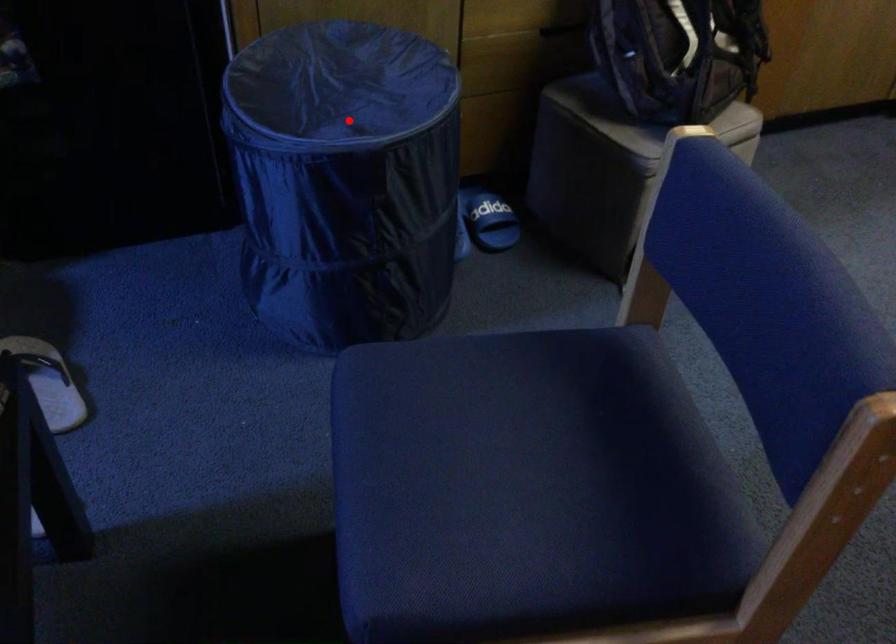
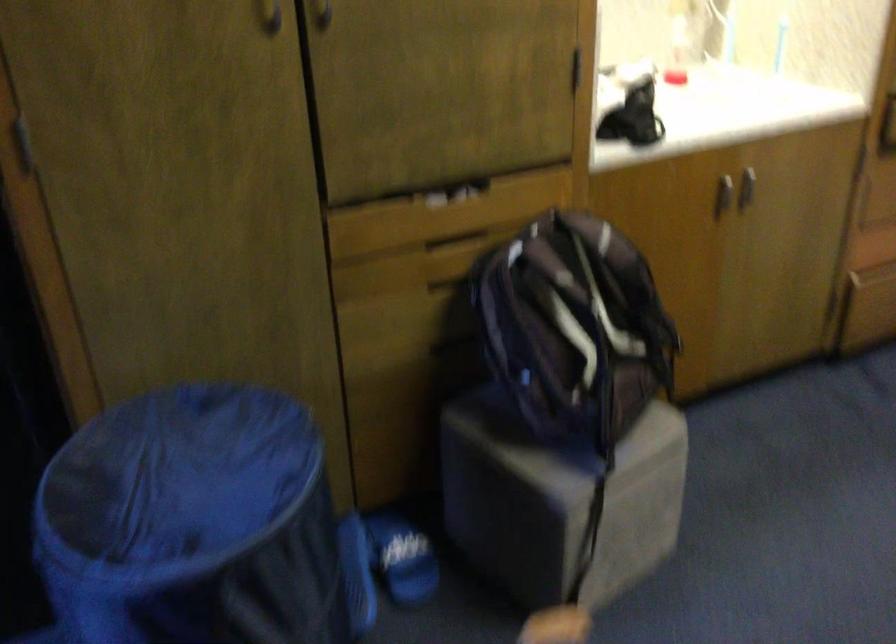
The point at the highlighted location is marked in the first image. Where is the corresponding point in the second image?

(193, 523)